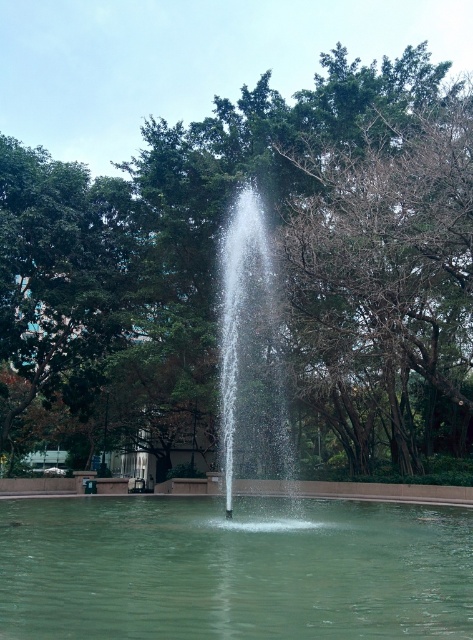
Measure the distance between green leafy tree at center and clear glass fountain at center.

They are 4.43 meters apart.

Who is more forward, (x=281, y=211) or (x=280, y=445)?

Point (x=281, y=211) is in front.

At what (x,y) coordinates should I click in order to perform the action: click on green leafy tree at center. Please return your answer as a coordinate pair (x, y). Image resolution: width=473 pixels, height=640 pixels. Looking at the image, I should click on (283, 268).

Is green translucent water at center to the right of clear glass fountain at center from the viewer's perspective?

Indeed, green translucent water at center is positioned on the right side of clear glass fountain at center.

Does green translucent water at center lie behind clear glass fountain at center?

No, it is in front of clear glass fountain at center.

Who is more distant from viewer, (285, 628) or (218, 250)?

The point (218, 250) is more distant.

Locate an element on the screen. green translucent water at center is located at coordinates (233, 570).

Can you confirm if green leafy tree at center is positioned to the left of green translucent water at center?

Correct, you'll find green leafy tree at center to the left of green translucent water at center.

Looking at this image, measure the distance between green leafy tree at center and green translucent water at center.

A distance of 36.58 feet exists between green leafy tree at center and green translucent water at center.

What do you see at coordinates (283, 268) in the screenshot? This screenshot has height=640, width=473. I see `green leafy tree at center` at bounding box center [283, 268].

Where is `green leafy tree at center`? The width and height of the screenshot is (473, 640). green leafy tree at center is located at coordinates (283, 268).